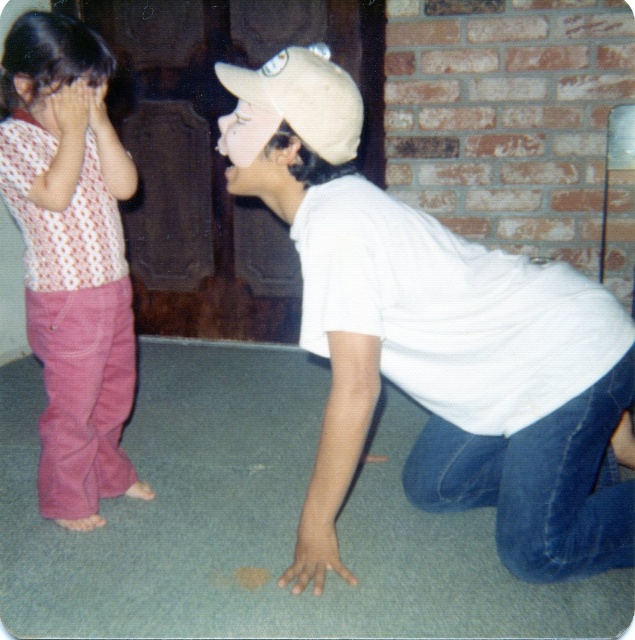
Is white matte shirt at center smaller than beige fabric baseball cap at center?

No, white matte shirt at center is not smaller than beige fabric baseball cap at center.

Between white matte shirt at center and beige fabric baseball cap at center, which one appears on the right side from the viewer's perspective?

From the viewer's perspective, white matte shirt at center appears more on the right side.

Where is `white matte shirt at center`? The width and height of the screenshot is (635, 640). white matte shirt at center is located at coordinates (436, 340).

The height and width of the screenshot is (640, 635). In order to click on white matte shirt at center in this screenshot , I will do `click(436, 340)`.

Does dotted fabric shirt at left appear under beige fabric baseball cap at center?

Correct, dotted fabric shirt at left is located below beige fabric baseball cap at center.

Which of these two, dotted fabric shirt at left or beige fabric baseball cap at center, stands shorter?

beige fabric baseball cap at center is shorter.

Image resolution: width=635 pixels, height=640 pixels. I want to click on dotted fabric shirt at left, so click(x=70, y=257).

Image resolution: width=635 pixels, height=640 pixels. I want to click on dotted fabric shirt at left, so click(70, 257).

Is white matte shirt at center positioned in front of dotted fabric shirt at left?

Yes, it is in front of dotted fabric shirt at left.

Find the location of `white matte shirt at center`. white matte shirt at center is located at coordinates (436, 340).